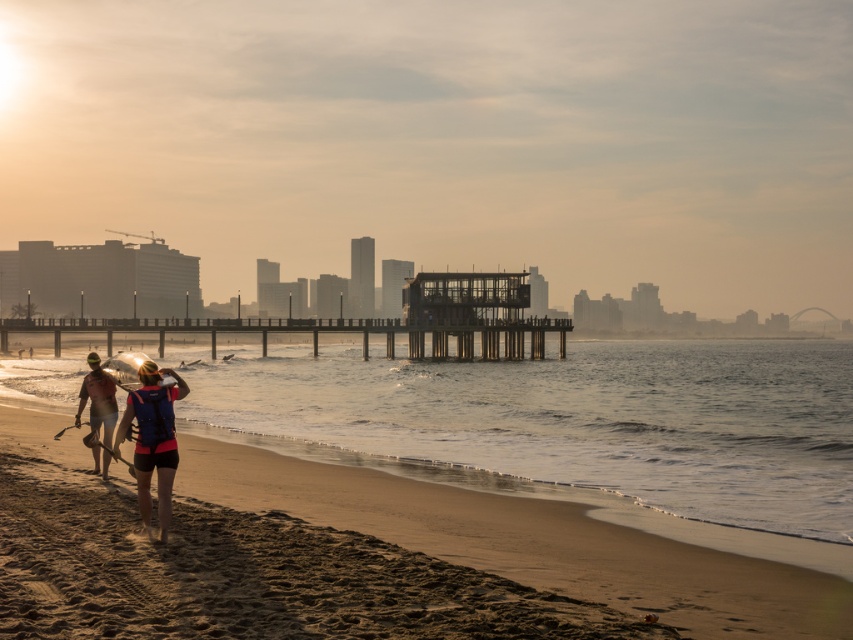
Question: Does blue life vest at center have a smaller size compared to matte pink shorts at left?

Choices:
 (A) yes
 (B) no

Answer: (A)

Question: Which point is closer to the camera?

Choices:
 (A) sandy beach at lower left
 (B) clear water at beach left
 (C) matte pink shorts at left

Answer: (A)

Question: Which object appears farthest from the camera in this image?

Choices:
 (A) clear water at beach left
 (B) wooden pier at center
 (C) blue life vest at center
 (D) sandy beach at lower left

Answer: (B)

Question: Is sandy beach at lower left below wooden pier at center?

Choices:
 (A) yes
 (B) no

Answer: (A)

Question: Does blue life vest at center appear on the left side of matte pink shorts at left?

Choices:
 (A) no
 (B) yes

Answer: (A)

Question: Which object is the closest to the blue life vest at center?

Choices:
 (A) wooden pier at center
 (B) matte pink shorts at left
 (C) clear water at beach left
 (D) sandy beach at lower left

Answer: (B)